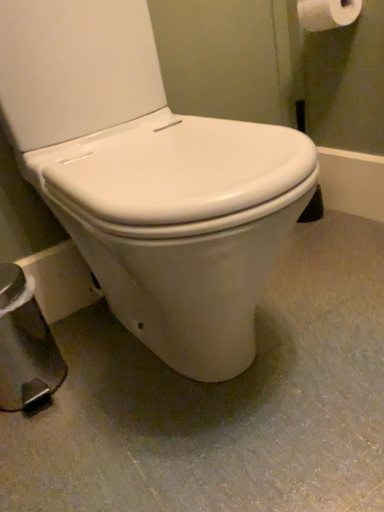
Question: Is white glossy toilet at center bigger than white smooth toilet at center?

Choices:
 (A) no
 (B) yes

Answer: (B)

Question: From the image's perspective, is white glossy toilet at center located above white smooth toilet at center?

Choices:
 (A) no
 (B) yes

Answer: (B)

Question: From a real-world perspective, is white glossy toilet at center positioned under white smooth toilet at center based on gravity?

Choices:
 (A) no
 (B) yes

Answer: (A)

Question: From a real-world perspective, is white glossy toilet at center on white smooth toilet at center?

Choices:
 (A) no
 (B) yes

Answer: (B)

Question: Is white smooth toilet at center inside white glossy toilet at center?

Choices:
 (A) yes
 (B) no

Answer: (B)

Question: Does point (167, 309) appear closer or farther from the camera than point (327, 9)?

Choices:
 (A) closer
 (B) farther

Answer: (A)

Question: Considering the relative positions of white glossy toilet at center and white matte toilet paper at upper right in the image provided, is white glossy toilet at center to the left or to the right of white matte toilet paper at upper right?

Choices:
 (A) left
 (B) right

Answer: (A)

Question: Is white glossy toilet at center taller or shorter than white matte toilet paper at upper right?

Choices:
 (A) short
 (B) tall

Answer: (B)

Question: In the image, is white glossy toilet at center positioned in front of or behind white matte toilet paper at upper right?

Choices:
 (A) behind
 (B) front

Answer: (B)

Question: In terms of width, does white matte toilet paper at upper right look wider or thinner when compared to white glossy toilet at center?

Choices:
 (A) wide
 (B) thin

Answer: (B)

Question: In the image, is white matte toilet paper at upper right on the left side or the right side of white glossy toilet at center?

Choices:
 (A) left
 (B) right

Answer: (B)

Question: Is white matte toilet paper at upper right taller or shorter than white glossy toilet at center?

Choices:
 (A) tall
 (B) short

Answer: (B)

Question: Choose the correct answer: Is white matte toilet paper at upper right inside white glossy toilet at center or outside it?

Choices:
 (A) inside
 (B) outside

Answer: (B)

Question: From their relative heights in the image, would you say white smooth toilet at center is taller or shorter than white glossy toilet at center?

Choices:
 (A) tall
 (B) short

Answer: (B)

Question: From a real-world perspective, relative to white glossy toilet at center, is white smooth toilet at center vertically above or below?

Choices:
 (A) below
 (B) above

Answer: (A)